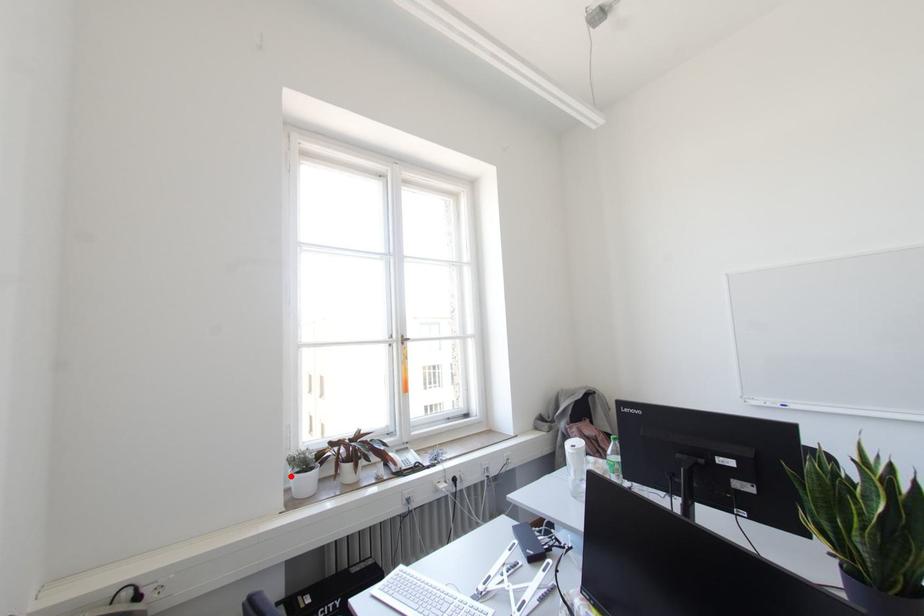
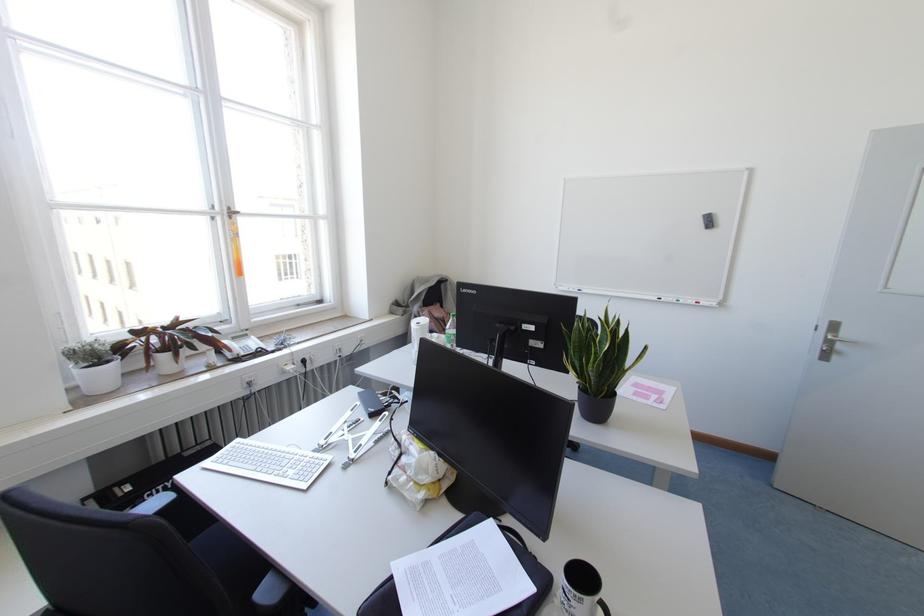
Question: I am providing you with two images of the same scene from different viewpoints. Image1 has a red point marked. In image2, the corresponding 3D location appears at what relative position? Reply with the corresponding letter.

Choices:
 (A) Closer
 (B) Farther

Answer: (A)